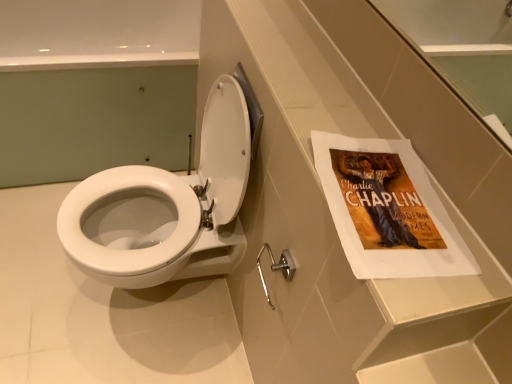
Locate an element on the screen. This screenshot has height=384, width=512. free area below white glossy toilet at center (from a real-world perspective) is located at coordinates (143, 302).